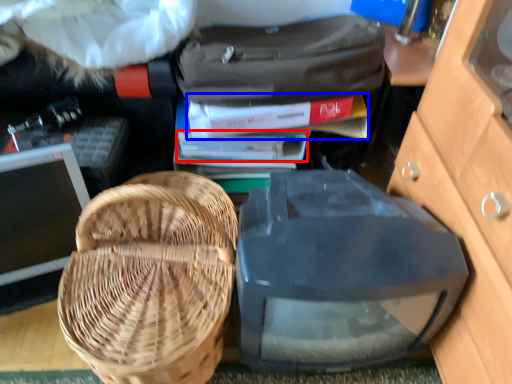
Question: Which point is further to the camera, book (highlighted by a red box) or book (highlighted by a blue box)?

Choices:
 (A) book
 (B) book

Answer: (A)